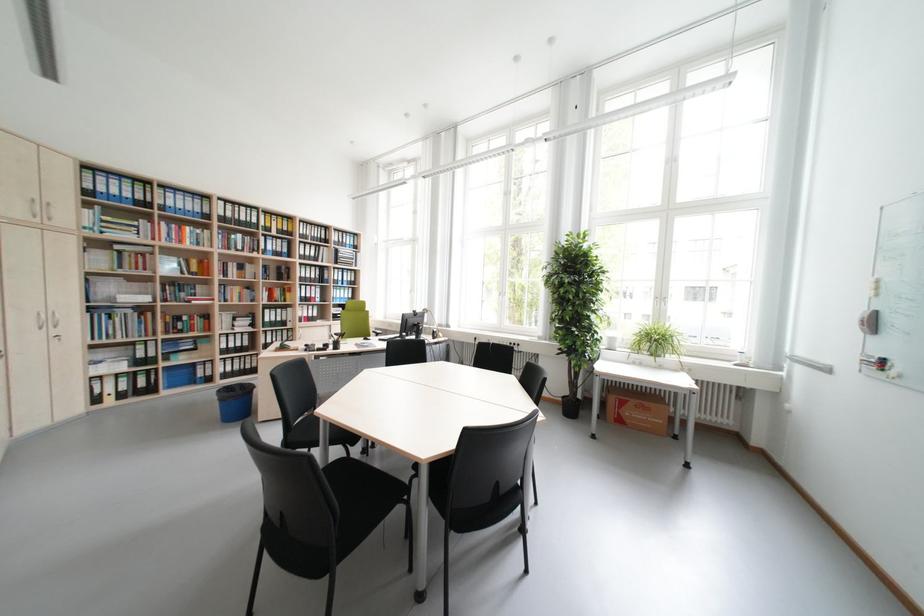
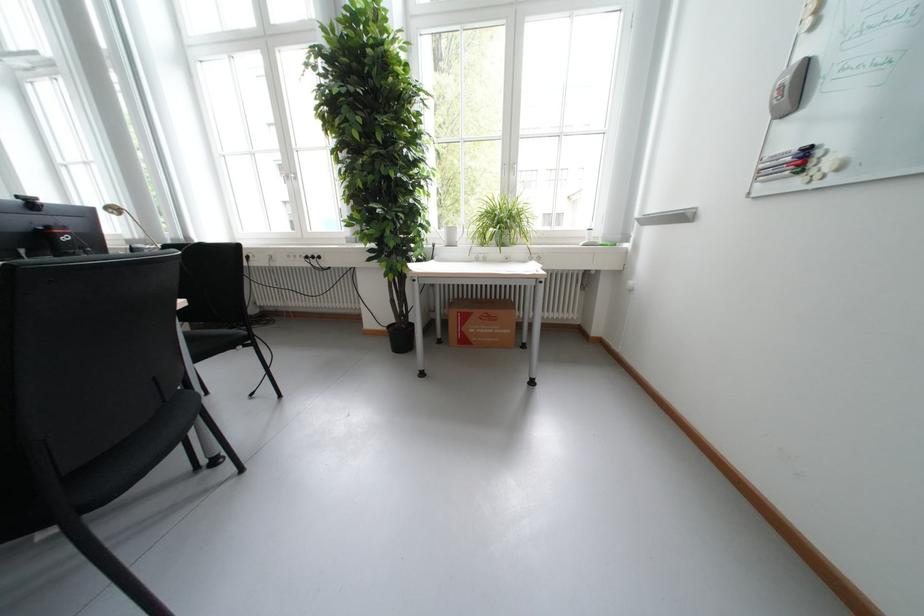
The point at [629,422] is marked in the first image. Where is the corresponding point in the second image?

(475, 342)